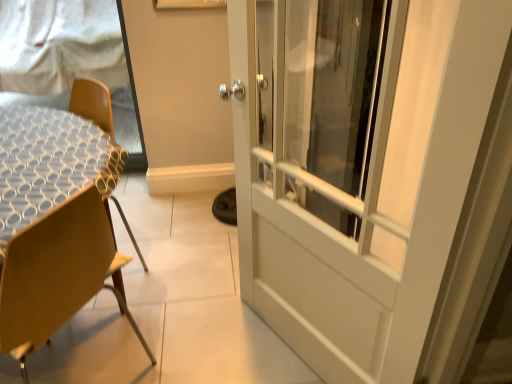
Question: Considering the relative sizes of white textured table at left and wooden chair at left in the image provided, is white textured table at left wider than wooden chair at left?

Choices:
 (A) no
 (B) yes

Answer: (A)

Question: Is wooden chair at left a part of white textured table at left?

Choices:
 (A) yes
 (B) no

Answer: (B)

Question: Does white textured table at left appear on the right side of wooden chair at left?

Choices:
 (A) yes
 (B) no

Answer: (B)

Question: Is white textured table at left far away from wooden chair at left?

Choices:
 (A) yes
 (B) no

Answer: (B)

Question: Is white textured table at left further to camera compared to wooden chair at left?

Choices:
 (A) no
 (B) yes

Answer: (B)

Question: Is white textured table at left turned away from wooden chair at left?

Choices:
 (A) no
 (B) yes

Answer: (A)

Question: Is wooden chair at left next to white textured table at left?

Choices:
 (A) no
 (B) yes

Answer: (A)

Question: From a real-world perspective, is wooden chair at left over white textured table at left?

Choices:
 (A) yes
 (B) no

Answer: (B)

Question: Is wooden chair at left behind white textured table at left?

Choices:
 (A) no
 (B) yes

Answer: (A)

Question: Can you confirm if wooden chair at left is positioned to the left of white textured table at left?

Choices:
 (A) no
 (B) yes

Answer: (A)

Question: Considering the relative sizes of wooden chair at left and white textured table at left in the image provided, is wooden chair at left shorter than white textured table at left?

Choices:
 (A) no
 (B) yes

Answer: (B)

Question: Considering the relative sizes of wooden chair at left and white textured table at left in the image provided, is wooden chair at left smaller than white textured table at left?

Choices:
 (A) no
 (B) yes

Answer: (A)

Question: Is white textured table at left in front of white mesh screen at upper left?

Choices:
 (A) yes
 (B) no

Answer: (A)